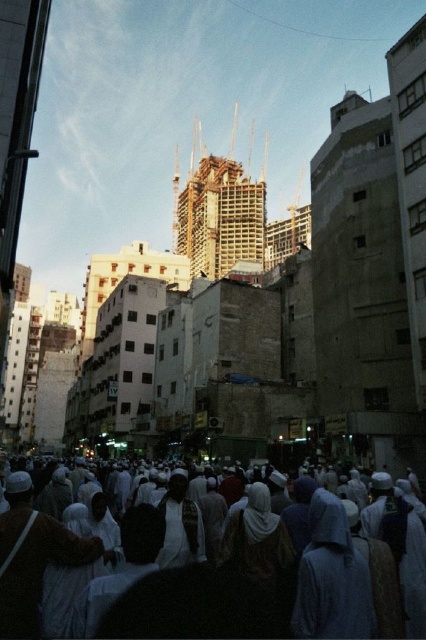
Question: Which of the following is the farthest from the observer?

Choices:
 (A) white matte robe at center
 (B) light brown fabric robe at lower left
 (C) white clothed crowd at center

Answer: (A)

Question: Which is nearer to the white clothed crowd at center?

Choices:
 (A) white matte robe at center
 (B) light brown fabric robe at lower left

Answer: (A)

Question: Can you confirm if light brown fabric robe at lower left is positioned below white matte robe at center?

Choices:
 (A) no
 (B) yes

Answer: (A)

Question: Does white clothed crowd at center have a larger size compared to light brown fabric robe at lower left?

Choices:
 (A) yes
 (B) no

Answer: (A)

Question: Is white clothed crowd at center thinner than white matte robe at center?

Choices:
 (A) no
 (B) yes

Answer: (A)

Question: Which of the following is the closest to the observer?

Choices:
 (A) (16, 531)
 (B) (244, 588)

Answer: (A)